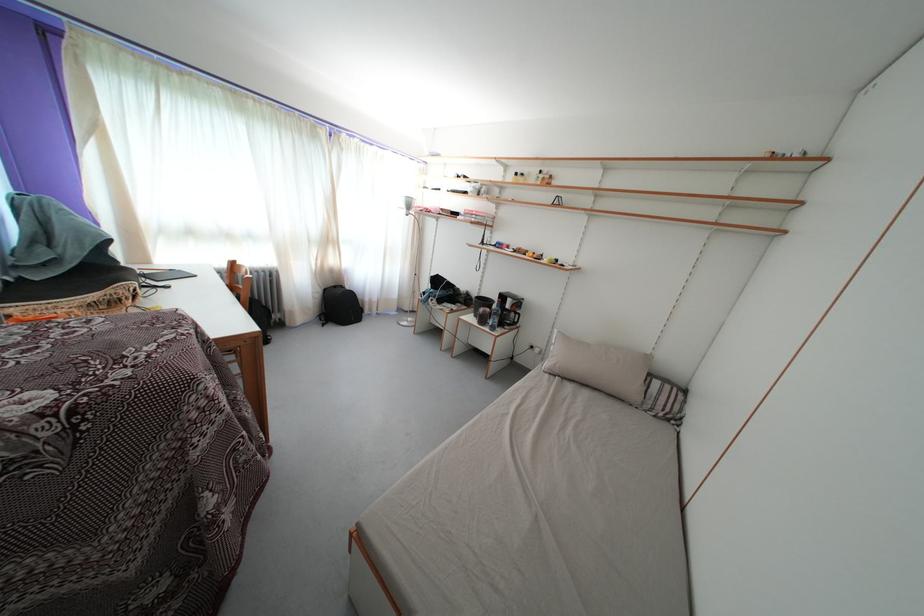
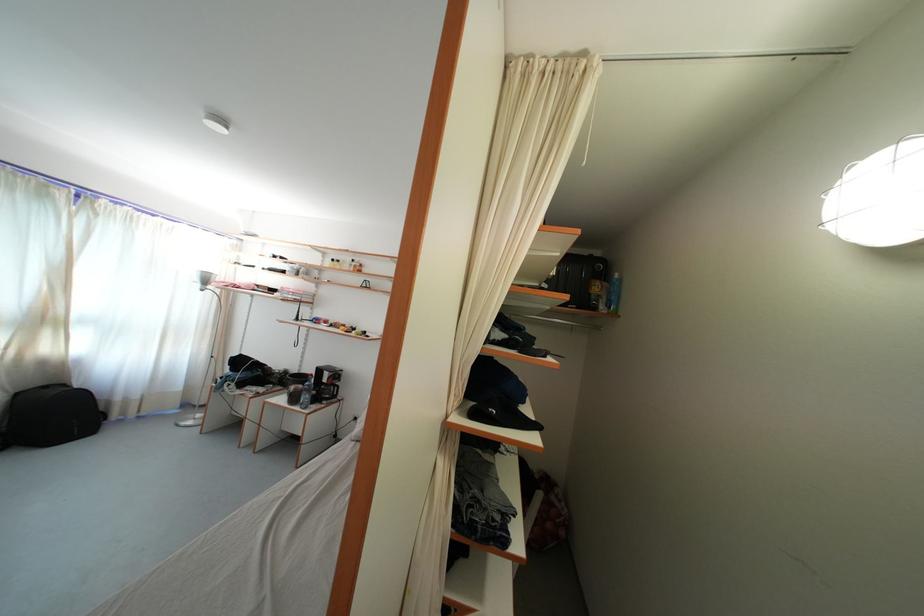
Locate, in the second image, the point that corresponds to point 489,326 in the first image.

(300, 405)